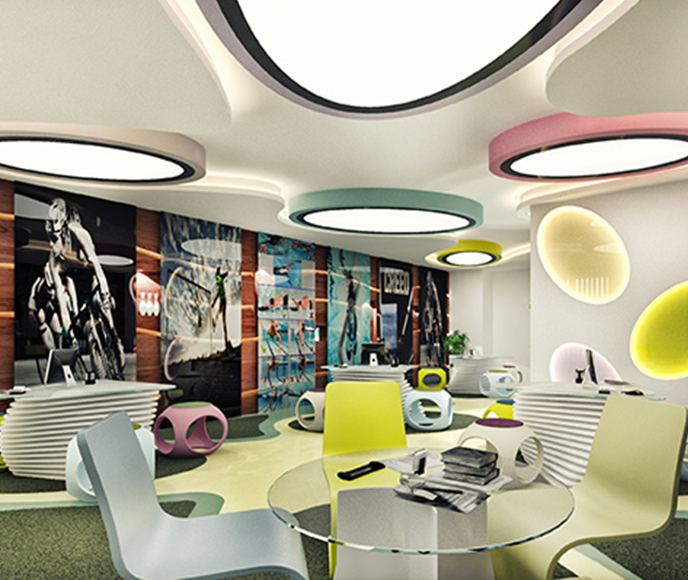
Where is `carpet`? carpet is located at coordinates (69, 541), (292, 449), (656, 553), (464, 411).